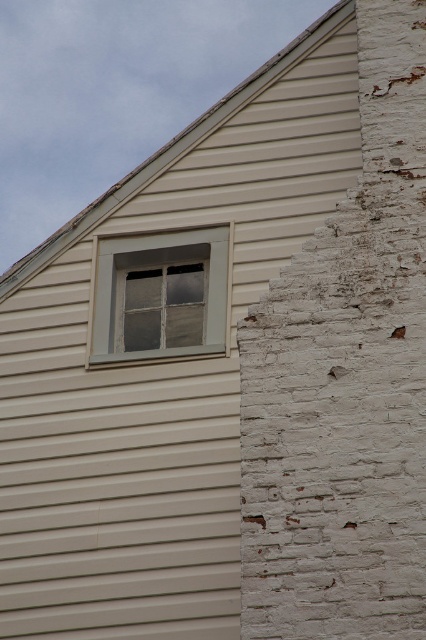
Is white painted brick siding at right taller than clear glass window at upper center?

Yes.

Between point (287, 515) and point (169, 275), which one is positioned behind?

The point (169, 275) is more distant.

Does point (342, 403) come farther from viewer compared to point (135, 272)?

No, (342, 403) is in front of (135, 272).

Identify the location of white painted brick siding at right. (345, 381).